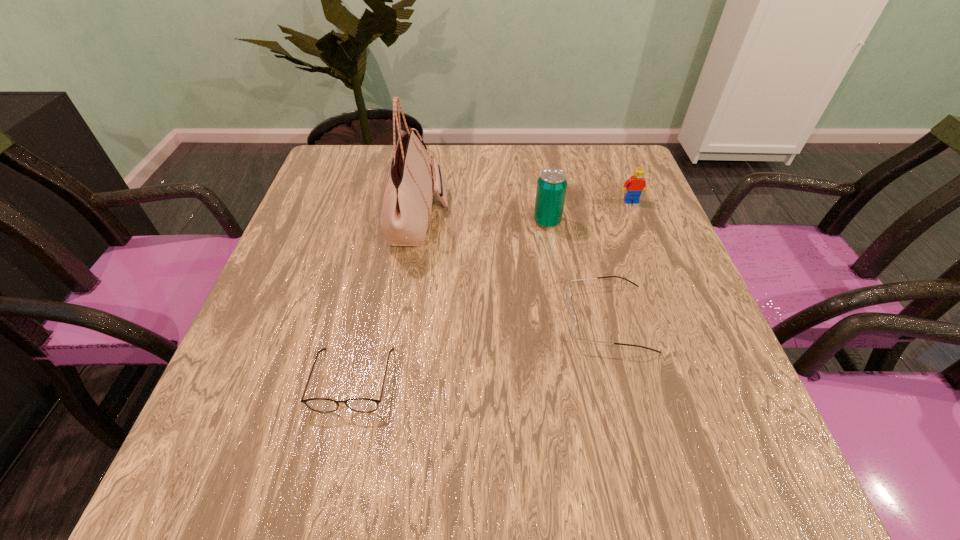
This screenshot has height=540, width=960. Identify the location of free space located 0.340m through the lenses of the right spectacles. (391, 318).

Locate an element on the screen. vacant region located through the lenses of the right spectacles is located at coordinates point(381,318).

The width and height of the screenshot is (960, 540). I want to click on free space located through the lenses of the right spectacles, so click(468, 318).

You are a GUI agent. You are given a task and a screenshot of the screen. Output one action in this format:
    pyautogui.click(x=<x>, y=<y>)
    Task: Click on the vacant area situated 0.060m on the front-facing side of the shortest object
    The height and width of the screenshot is (540, 960).
    Given the screenshot: What is the action you would take?
    pos(337,450)

Locate an element on the screen. Image resolution: width=960 pixels, height=540 pixels. object located at the far edge is located at coordinates (406, 208).

Image resolution: width=960 pixels, height=540 pixels. I want to click on object at the left edge, so click(364, 405).

At what (x,y) coordinates should I click in order to perform the action: click on Lego at the right edge. Please return your answer as a coordinate pair (x, y). This screenshot has height=540, width=960. Looking at the image, I should click on (634, 186).

Where is `spectacles located in the right edge section of the desktop`? Image resolution: width=960 pixels, height=540 pixels. spectacles located in the right edge section of the desktop is located at coordinates (572, 322).

Locate an element on the screen. This screenshot has width=960, height=540. vacant space at the far edge is located at coordinates (458, 185).

This screenshot has height=540, width=960. I want to click on blank space at the near edge of the desktop, so click(x=324, y=497).